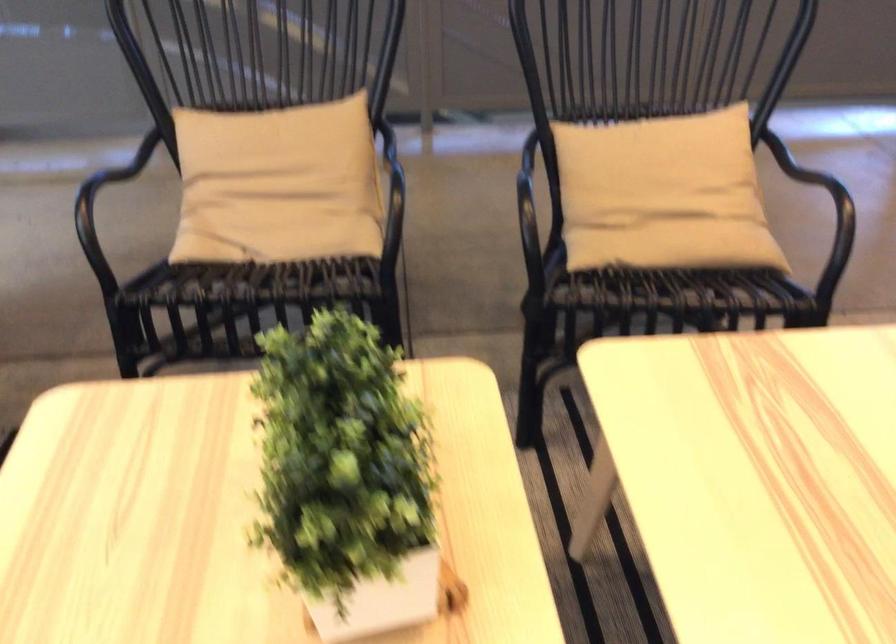
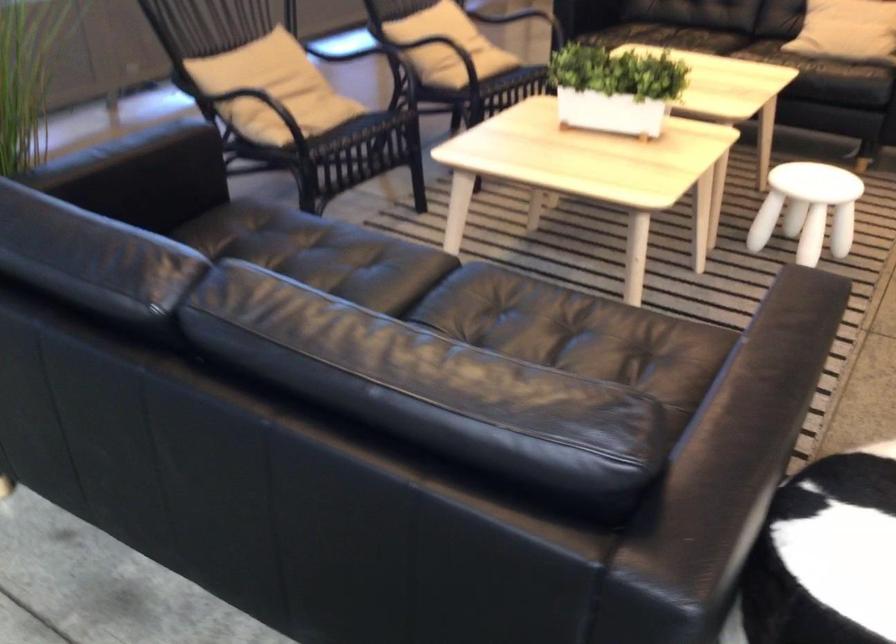
Where in the second image is the point corresponding to (x=359, y=478) from the first image?

(615, 88)